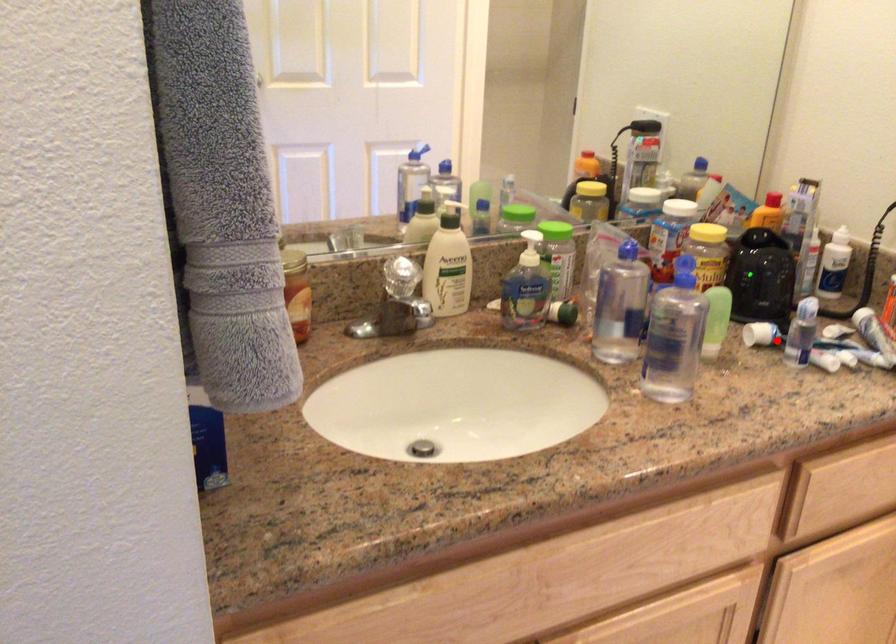
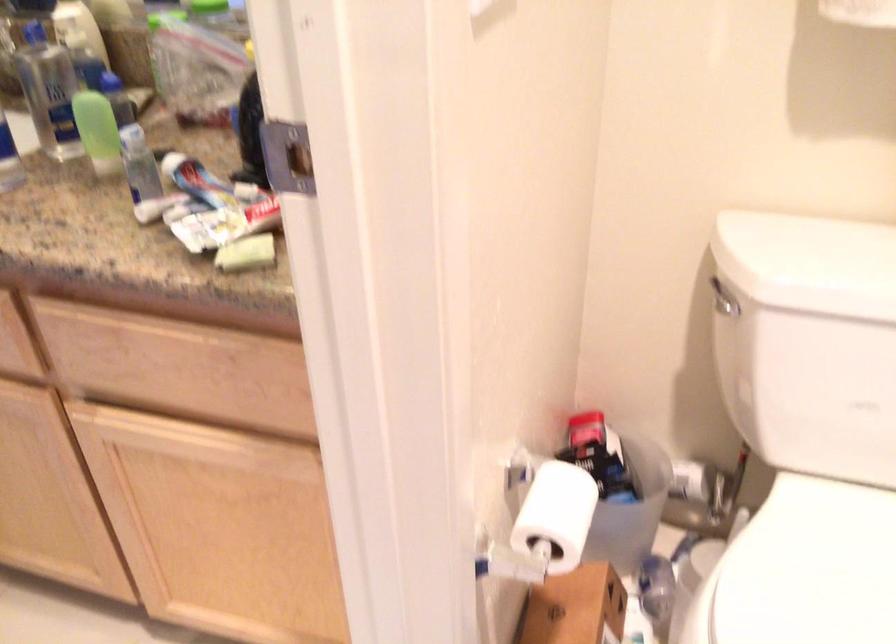
Locate, in the second image, the point that corresponds to the highlighted location in the first image.

(197, 182)